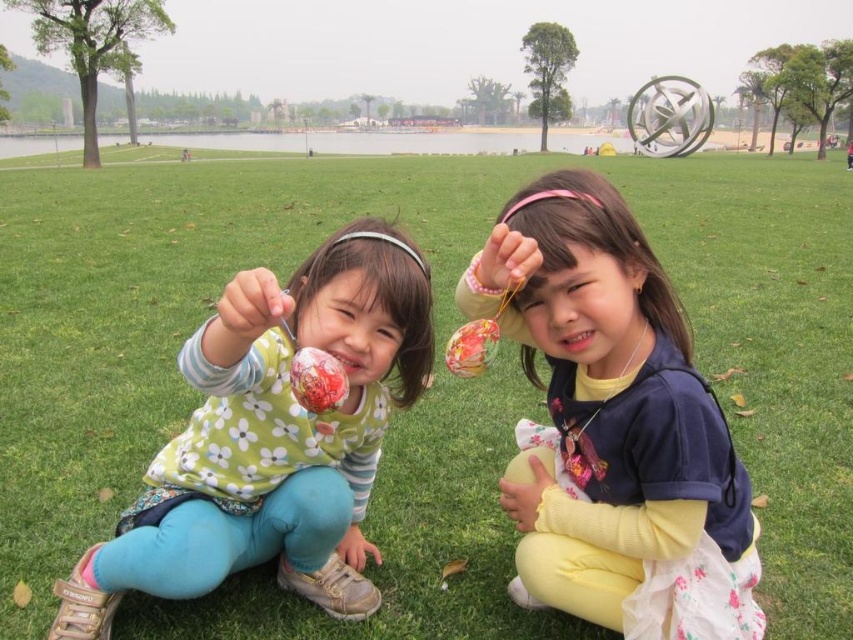
Question: Which object appears farthest from the camera in this image?

Choices:
 (A) multicolored glossy egg at center
 (B) shiny plastic egg at center

Answer: (A)

Question: Can you confirm if shiny plastic egg at center is bigger than multicolored glossy egg at center?

Choices:
 (A) yes
 (B) no

Answer: (A)

Question: Does matte plastic hand at center have a smaller size compared to shiny plastic egg at center?

Choices:
 (A) yes
 (B) no

Answer: (A)

Question: Which point appears farthest from the camera in this image?

Choices:
 (A) (184, 557)
 (B) (480, 328)
 (C) (628, 577)

Answer: (C)

Question: Among these objects, which one is farthest from the camera?

Choices:
 (A) multicolored glossy egg at center
 (B) shiny plastic egg at center
 (C) matte pink headband at center
 (D) matte plastic hand at center

Answer: (A)

Question: Is matte plastic hand at center to the left of multicolored glossy egg at center from the viewer's perspective?

Choices:
 (A) no
 (B) yes

Answer: (B)